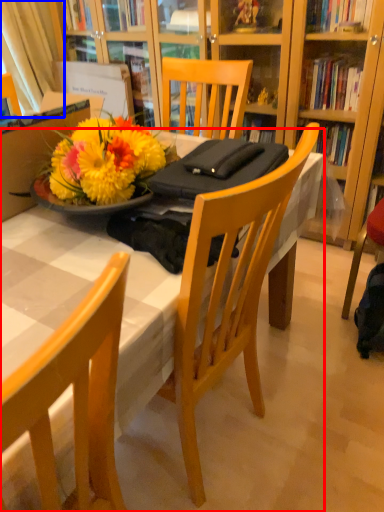
Question: Which of the following is the closest to the observer, desk (highlighted by a red box) or curtain (highlighted by a blue box)?

Choices:
 (A) desk
 (B) curtain

Answer: (A)